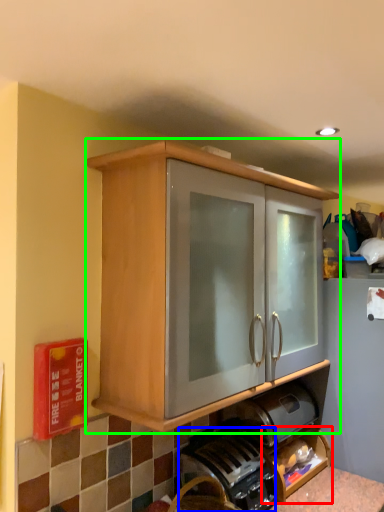
Question: Which is nearer to the shelf (highlighted by a red box)? coffee machine (highlighted by a blue box) or cabinetry (highlighted by a green box).

Choices:
 (A) coffee machine
 (B) cabinetry

Answer: (A)